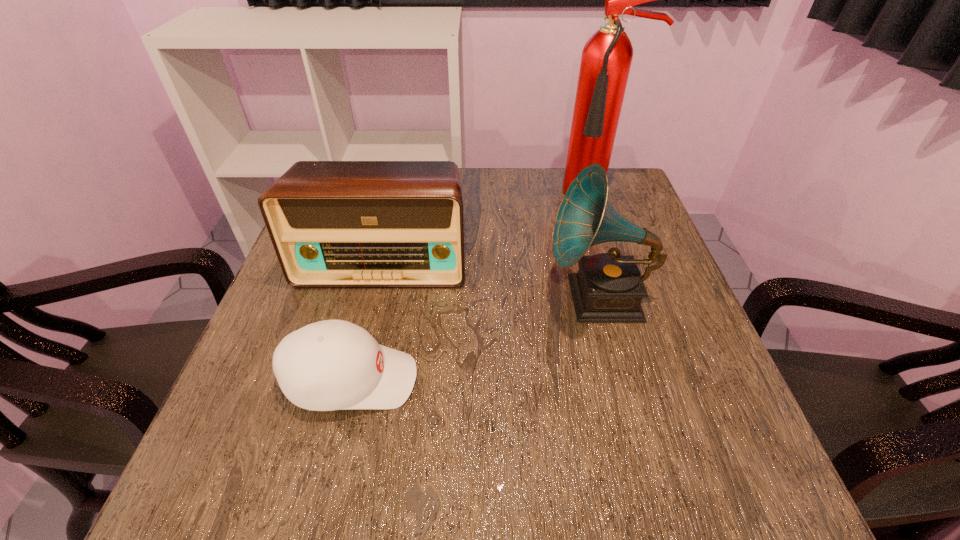
The height and width of the screenshot is (540, 960). I want to click on vacant point at the near left corner, so click(275, 482).

In the image, there is a desktop. At what (x,y) coordinates should I click in order to perform the action: click on vacant space at the far right corner. Please return your answer as a coordinate pair (x, y). Image resolution: width=960 pixels, height=540 pixels. Looking at the image, I should click on (636, 202).

In the image, there is a desktop. Identify the location of free space at the near right corner. This screenshot has height=540, width=960. [733, 462].

At what (x,y) coordinates should I click in order to perform the action: click on free spot between the phonograph_record and the farthest object. Please return your answer as a coordinate pair (x, y). The height and width of the screenshot is (540, 960). Looking at the image, I should click on (598, 247).

Where is `free space between the phonograph_record and the nearest object`? This screenshot has height=540, width=960. free space between the phonograph_record and the nearest object is located at coordinates (475, 339).

Locate an element on the screen. free space between the nearest object and the third shortest object is located at coordinates (475, 339).

The image size is (960, 540). I want to click on empty space between the radio receiver and the nearest object, so click(367, 321).

Find the location of a particular element. This screenshot has height=540, width=960. vacant space that is in between the phonograph_record and the second shortest object is located at coordinates pos(491,280).

Where is `free space between the fire extinguisher and the third tallest object`? This screenshot has height=540, width=960. free space between the fire extinguisher and the third tallest object is located at coordinates (490, 229).

Find the location of `free space between the baseball cap and the third tallest object`. free space between the baseball cap and the third tallest object is located at coordinates (367, 321).